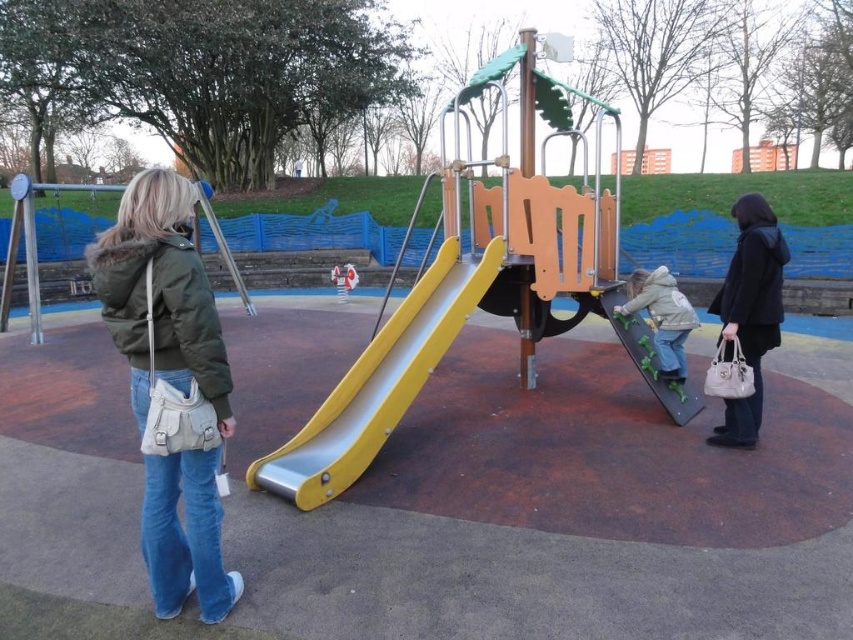
Question: Estimate the real-world distances between objects in this image. Which object is closer to the matte green jacket at left?

Choices:
 (A) yellow metallic slide at center
 (B) light gray fleece jacket at center

Answer: (A)

Question: Which of the following is the closest to the observer?

Choices:
 (A) (633, 273)
 (B) (138, 236)
 (C) (73, 272)
 (D) (474, 298)

Answer: (B)

Question: Is black leather jacket at right to the left of light gray fleece jacket at center from the viewer's perspective?

Choices:
 (A) no
 (B) yes

Answer: (A)

Question: Can you confirm if yellow metallic slide at center is thinner than black leather jacket at right?

Choices:
 (A) yes
 (B) no

Answer: (B)

Question: Can you confirm if yellow metallic slide at center is thinner than metallic silver swing at left?

Choices:
 (A) yes
 (B) no

Answer: (B)

Question: Which object appears closest to the camera in this image?

Choices:
 (A) yellow metallic slide at center
 (B) metallic silver swing at left
 (C) black leather jacket at right
 (D) matte green jacket at left

Answer: (D)